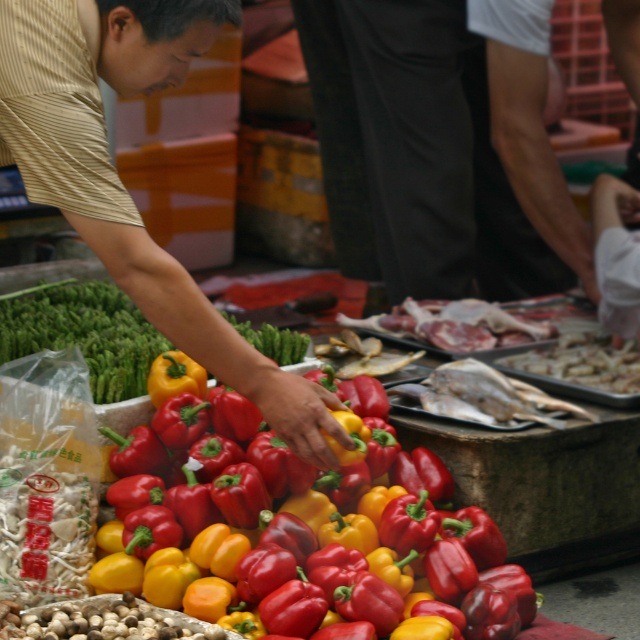
Between matte yellow pepper at center and shiny silver tray at center, which one is positioned lower?

shiny silver tray at center is lower down.

Who is more forward, (205,342) or (572,349)?

Positioned in front is point (205,342).

Does point (168, 12) lie in front of point (602, 374)?

Yes.

The height and width of the screenshot is (640, 640). Find the location of `matte yellow pepper at center`. matte yellow pepper at center is located at coordinates [120, 182].

Can you confirm if yellow matte bell pepper at center is smaller than shiny silver tray at center?

Actually, yellow matte bell pepper at center might be larger than shiny silver tray at center.

Does yellow matte bell pepper at center have a greater width compared to shiny silver tray at center?

Indeed, yellow matte bell pepper at center has a greater width compared to shiny silver tray at center.

Who is more forward, (374, 557) or (586, 339)?

Point (374, 557) is in front.

You are a GUI agent. You are given a task and a screenshot of the screen. Output one action in this format:
    pyautogui.click(x=<x>, y=<y>)
    Task: Click on the yellow matte bell pepper at center
    The height and width of the screenshot is (640, 640).
    Given the screenshot: What is the action you would take?
    pyautogui.click(x=310, y=540)

Does yellow matte bell pepper at center have a greater width compared to matte yellow pepper at center?

Yes.

Does yellow matte bell pepper at center have a lesser height compared to matte yellow pepper at center?

Correct, yellow matte bell pepper at center is not as tall as matte yellow pepper at center.

Which is behind, point (225, 516) or point (124, 76)?

Point (225, 516)

The height and width of the screenshot is (640, 640). I want to click on yellow matte bell pepper at center, so click(x=310, y=540).